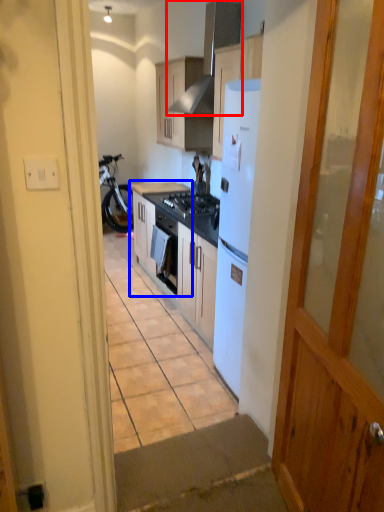
Question: Which point is further to the camera, kitchen appliance (highlighted by a red box) or cabinetry (highlighted by a blue box)?

Choices:
 (A) kitchen appliance
 (B) cabinetry

Answer: (B)